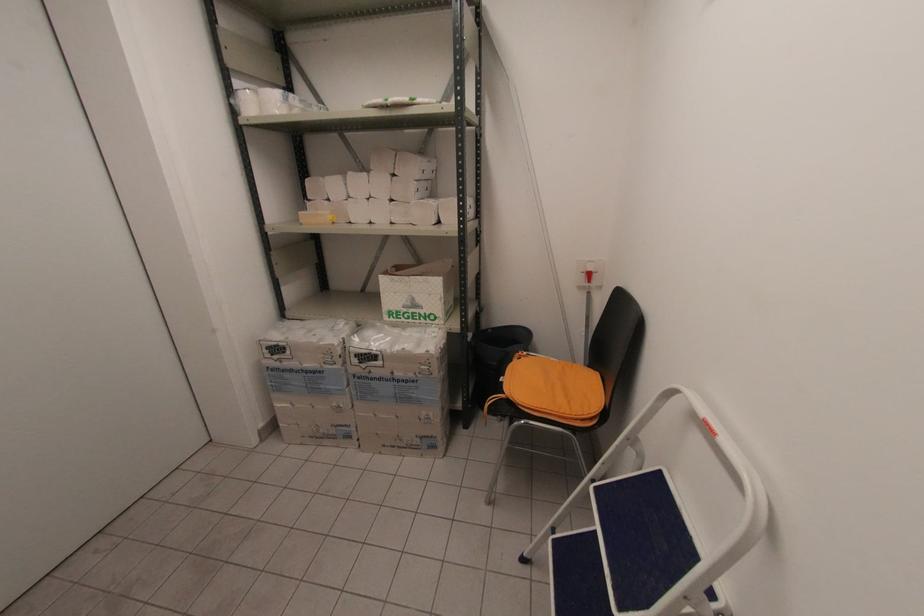
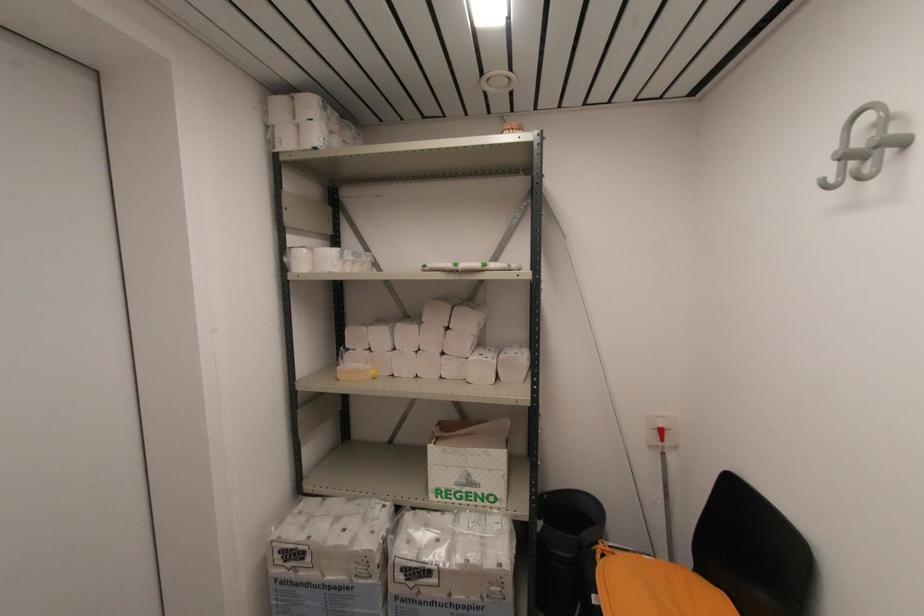
In the second image, find the point that corresponds to point 469,339 in the first image.

(540, 530)